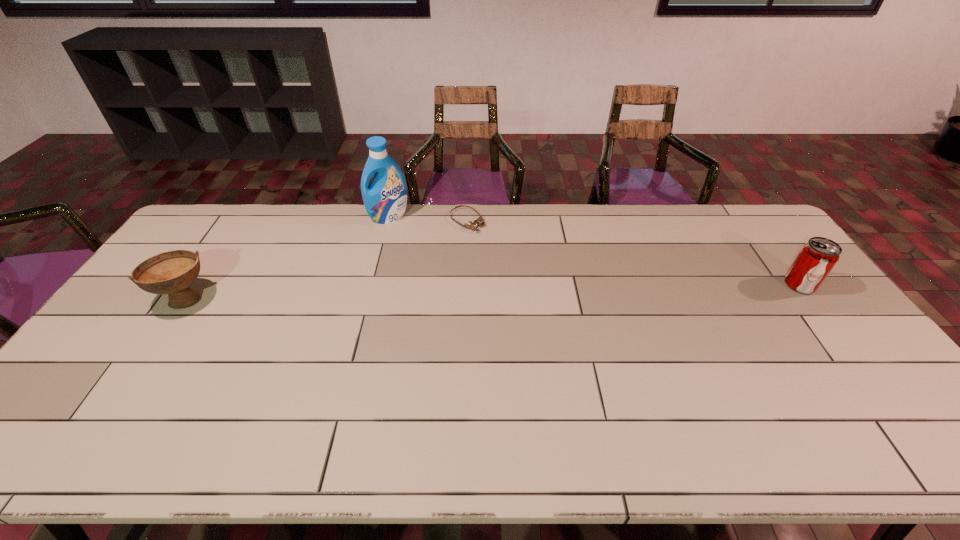
The width and height of the screenshot is (960, 540). Find the location of `vacant space at the right edge of the desktop`. vacant space at the right edge of the desktop is located at coordinates (772, 255).

Where is `free space at the far left corner of the desktop`? free space at the far left corner of the desktop is located at coordinates (210, 238).

In the image, there is a desktop. Where is `vacant region at the far right corner`? vacant region at the far right corner is located at coordinates (743, 232).

Identify the location of free space between the rightmost object and the shortest object. The height and width of the screenshot is (540, 960). (634, 253).

Find the location of a particular element. This screenshot has height=540, width=960. free space between the second object from right to left and the soup bowl is located at coordinates (326, 260).

In order to click on vacant space in between the tallest object and the goggles in this screenshot , I will do `click(428, 219)`.

I want to click on free spot between the soup bowl and the goggles, so click(326, 260).

Image resolution: width=960 pixels, height=540 pixels. Identify the location of free space between the shortest object and the pop soda. [x=634, y=253].

Find the location of a particular element. This screenshot has width=960, height=540. empty space between the pop soda and the soup bowl is located at coordinates (492, 292).

The width and height of the screenshot is (960, 540). Find the location of `free space between the shortest object and the third object from right to left`. free space between the shortest object and the third object from right to left is located at coordinates [428, 219].